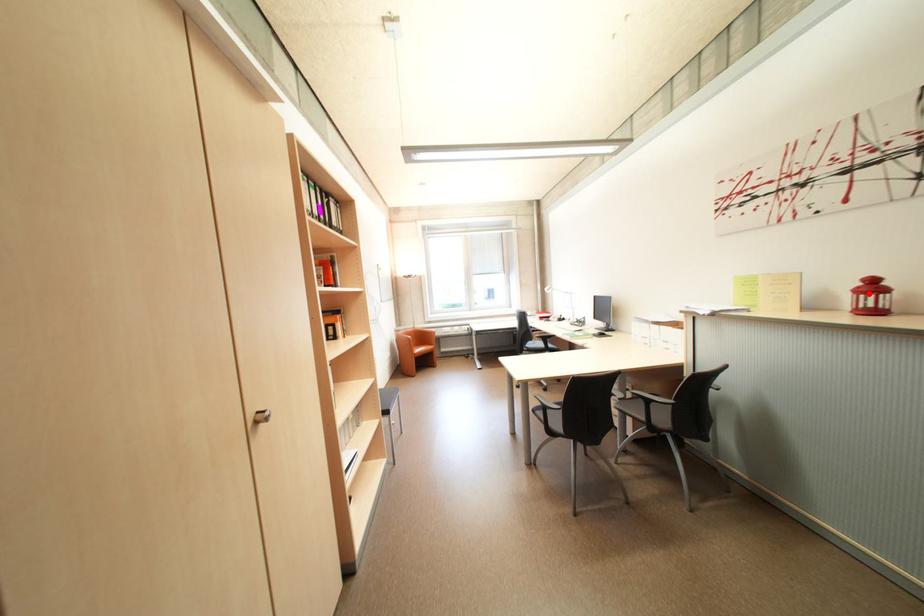
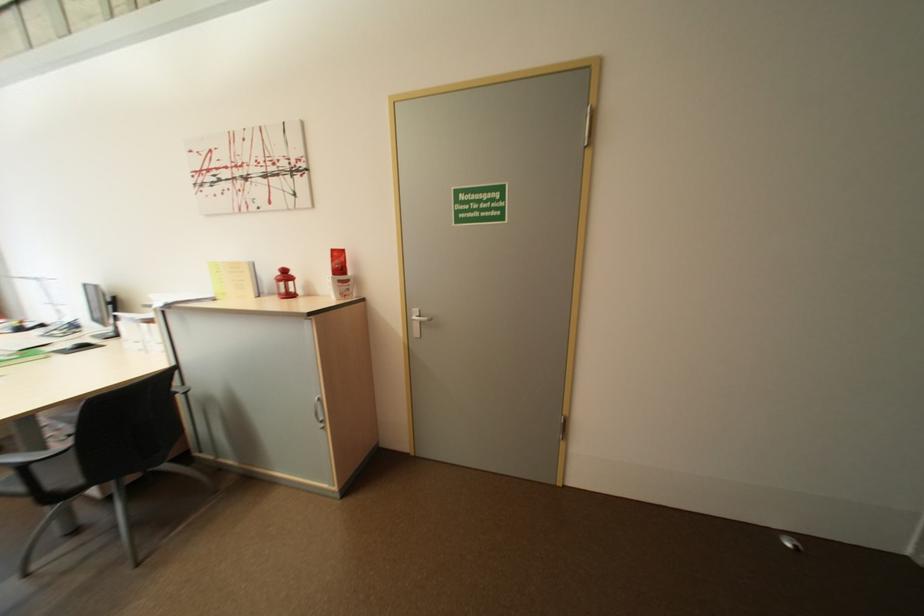
Question: I am providing you with two images of the same scene from different viewpoints. A red point is shown in image1. For the corresponding object point in image2, is it positioned nearer or farther from the camera?

Choices:
 (A) Nearer
 (B) Farther

Answer: (A)